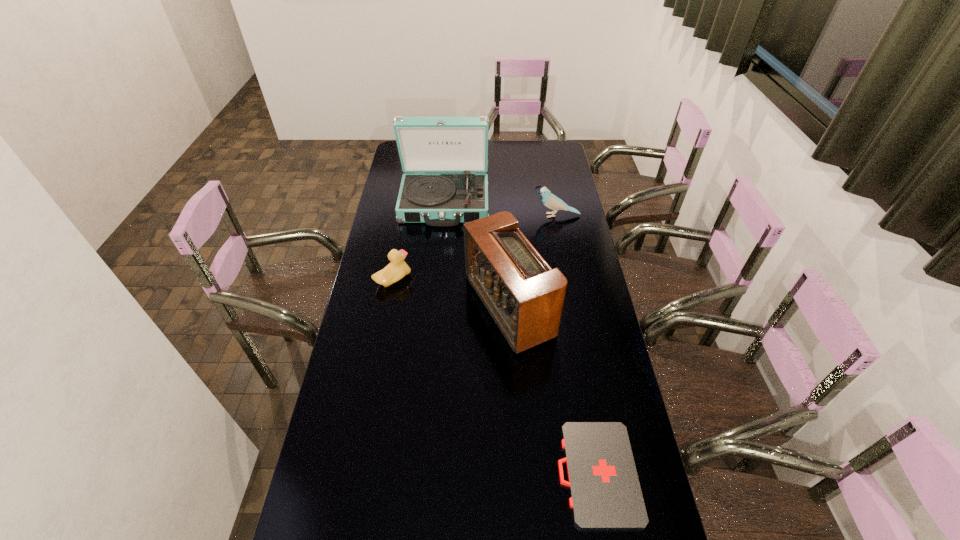
At what (x,y) coordinates should I click in order to perform the action: click on vacant position located 0.180m at the face of the bird. Please return your answer as a coordinate pair (x, y). The width and height of the screenshot is (960, 540). Looking at the image, I should click on (492, 215).

The image size is (960, 540). In order to click on vacant space located 0.270m at the beak of the duck in this screenshot , I will do `click(482, 280)`.

This screenshot has height=540, width=960. I want to click on vacant region located 0.370m on handle side the first-aid kit, so click(420, 473).

At what (x,y) coordinates should I click in order to perform the action: click on vacant space positioned 0.330m on handle side the first-aid kit. Please return your answer as a coordinate pair (x, y). This screenshot has height=540, width=960. Looking at the image, I should click on (436, 473).

This screenshot has width=960, height=540. Find the location of `free location located on handle side the first-aid kit`. free location located on handle side the first-aid kit is located at coordinates click(413, 473).

Identify the location of record player that is at the left edge. The image size is (960, 540). (448, 149).

Locate an element on the screen. The image size is (960, 540). duck that is at the left edge is located at coordinates (397, 268).

This screenshot has height=540, width=960. I want to click on bird that is at the right edge, so click(551, 201).

Locate an element on the screen. The height and width of the screenshot is (540, 960). the first-aid kit that is at the right edge is located at coordinates (605, 492).

At what (x,y) coordinates should I click in order to perform the action: click on vacant space at the left edge. Please return your answer as a coordinate pair (x, y). The image size is (960, 540). Looking at the image, I should click on (350, 378).